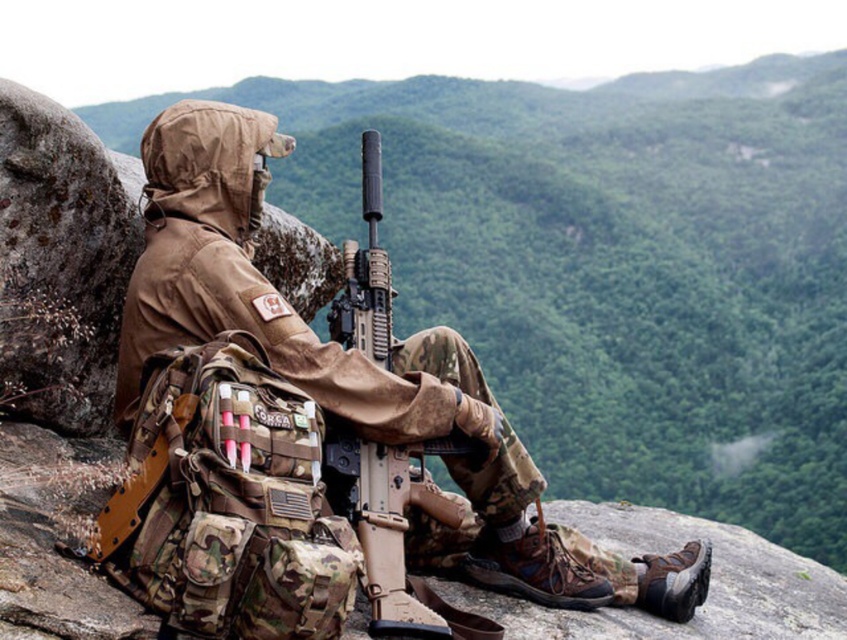
Is camo fabric uniform at center taller than matte black rifle at center?

Yes, camo fabric uniform at center is taller than matte black rifle at center.

Looking at this image, can you confirm if camo fabric uniform at center is thinner than matte black rifle at center?

In fact, camo fabric uniform at center might be wider than matte black rifle at center.

This screenshot has width=847, height=640. What do you see at coordinates (319, 340) in the screenshot?
I see `camo fabric uniform at center` at bounding box center [319, 340].

The height and width of the screenshot is (640, 847). Identify the location of camo fabric uniform at center. (319, 340).